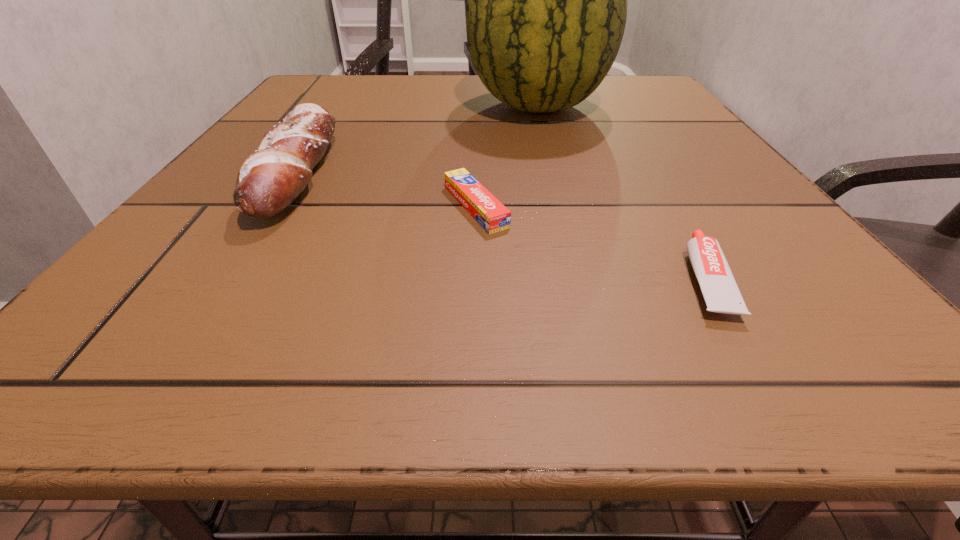
Identify the location of free space located on the right of the farther toothpaste. (590, 206).

Locate an element on the screen. The width and height of the screenshot is (960, 540). object positioned at the far edge is located at coordinates (546, 12).

Find the location of `object that is at the near edge`. object that is at the near edge is located at coordinates pos(720,291).

Image resolution: width=960 pixels, height=540 pixels. Identify the location of object that is at the left edge. (269, 180).

The width and height of the screenshot is (960, 540). Identify the location of watermelon located in the right edge section of the desktop. (546, 12).

This screenshot has width=960, height=540. In order to click on toothpaste that is positioned at the right edge in this screenshot , I will do `click(720, 291)`.

At what (x,y) coordinates should I click in order to perform the action: click on object that is at the far right corner. Please return your answer as a coordinate pair (x, y). The image size is (960, 540). Looking at the image, I should click on (546, 12).

Find the location of a particular element. The image size is (960, 540). object positioned at the near right corner is located at coordinates (720, 291).

The image size is (960, 540). In order to click on vacant space at the far edge of the desktop in this screenshot , I will do `click(473, 93)`.

The height and width of the screenshot is (540, 960). I want to click on blank space at the near edge of the desktop, so click(516, 373).